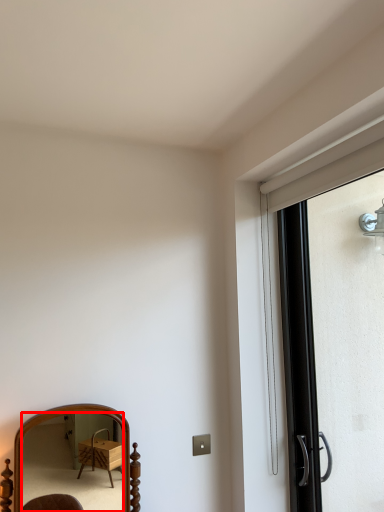
Question: From the image's perspective, where is mirror (annotated by the red box) located relative to screen door?

Choices:
 (A) above
 (B) below

Answer: (B)